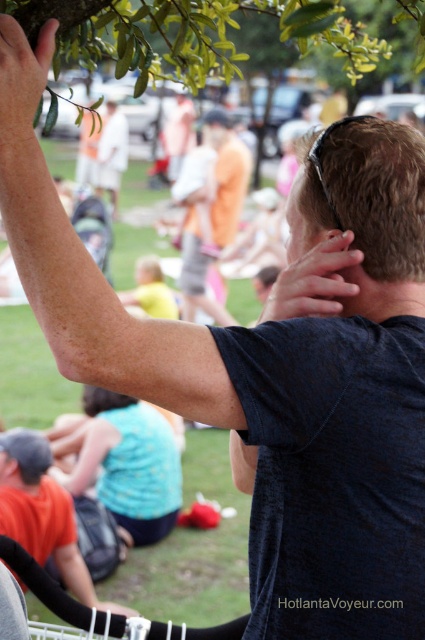
Question: Which object is farther from the camera taking this photo?

Choices:
 (A) matte black shirt at center
 (B) matte black hand at upper center
 (C) green matte leaf at upper left

Answer: (A)

Question: Considering the relative positions of orange cotton shorts at center and green matte leaf at upper left in the image provided, where is orange cotton shorts at center located with respect to green matte leaf at upper left?

Choices:
 (A) above
 (B) below

Answer: (A)

Question: Estimate the real-world distances between objects in this image. Which object is closer to the matte black hand at upper center?

Choices:
 (A) matte black shirt at center
 (B) green leafy branch at upper center
 (C) orange cotton shorts at center

Answer: (B)

Question: Observing the image, what is the correct spatial positioning of green leafy branch at upper center in reference to matte black hand at upper center?

Choices:
 (A) above
 (B) below

Answer: (A)

Question: Does green leafy branch at upper center come behind matte black shirt at center?

Choices:
 (A) no
 (B) yes

Answer: (A)

Question: Which object is closer to the camera taking this photo?

Choices:
 (A) orange cotton shorts at center
 (B) matte black hand at upper center
 (C) matte black shirt at center
 (D) green leafy branch at upper center

Answer: (D)